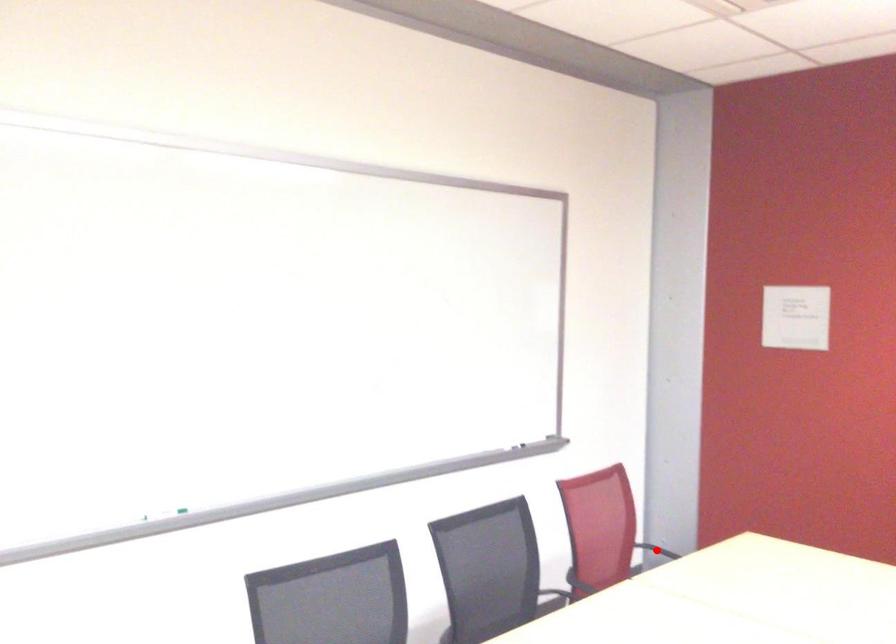
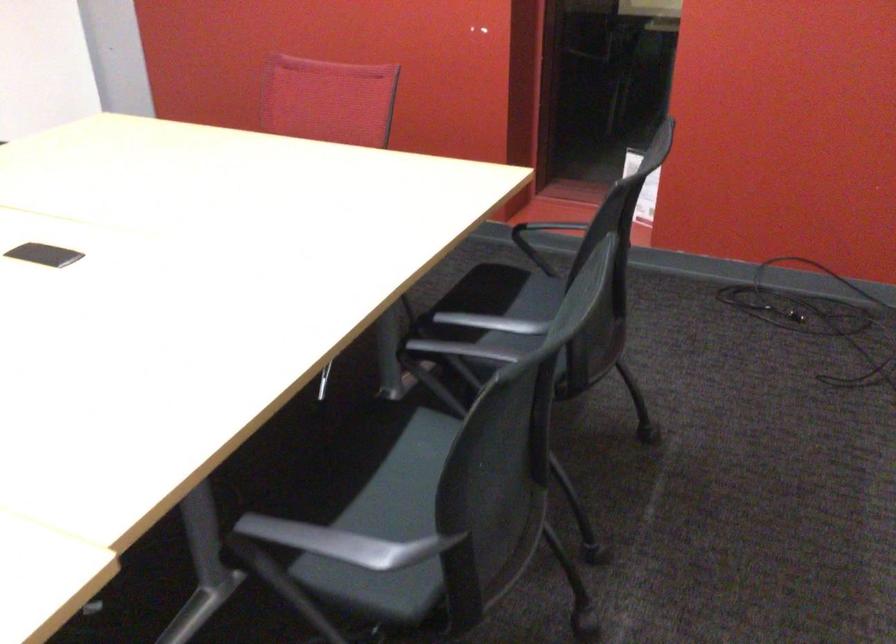
Question: I am providing you with two images of the same scene from different viewpoints. A red point is marked on the first image. At the location where the point appears in image 1, is it still visible in image 2?

Choices:
 (A) Yes
 (B) No

Answer: (B)